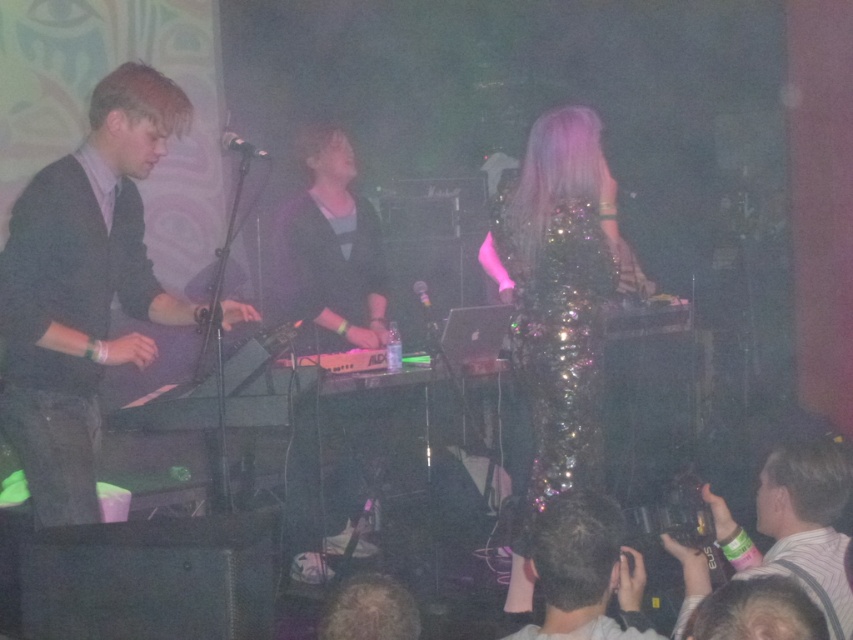
Is sparkly sequined dress at center taller than white striped shirt at lower right?

Indeed, sparkly sequined dress at center has a greater height compared to white striped shirt at lower right.

Does point (532, 262) come behind point (727, 545)?

Yes, it is behind point (727, 545).

The image size is (853, 640). Identify the location of sparkly sequined dress at center. (561, 289).

Is sparkly sequined dress at center to the left of matte black keyboard at center from the viewer's perspective?

In fact, sparkly sequined dress at center is to the right of matte black keyboard at center.

Between sparkly sequined dress at center and matte black keyboard at center, which one is positioned lower?

Positioned lower is sparkly sequined dress at center.

Is point (520, 586) farther from camera compared to point (376, 291)?

That is False.

You are a GUI agent. You are given a task and a screenshot of the screen. Output one action in this format:
    pyautogui.click(x=<x>, y=<y>)
    Task: Click on the sparkly sequined dress at center
    
    Given the screenshot: What is the action you would take?
    [x=561, y=289]

Can you confirm if matte black suit at left is wider than matte black keyboard at center?

Indeed, matte black suit at left has a greater width compared to matte black keyboard at center.

Is matte black suit at left bigger than matte black keyboard at center?

Correct, matte black suit at left is larger in size than matte black keyboard at center.

Is point (62, 396) less distant than point (357, 321)?

Yes, point (62, 396) is closer to viewer.

Find the location of a particular element. matte black suit at left is located at coordinates (82, 289).